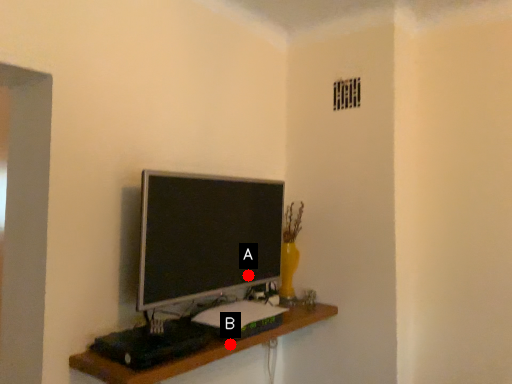
Question: Two points are circled on the image, labeled by A and B beside each circle. Among these points, which one is farthest from the camera?

Choices:
 (A) A is further
 (B) B is further

Answer: (A)